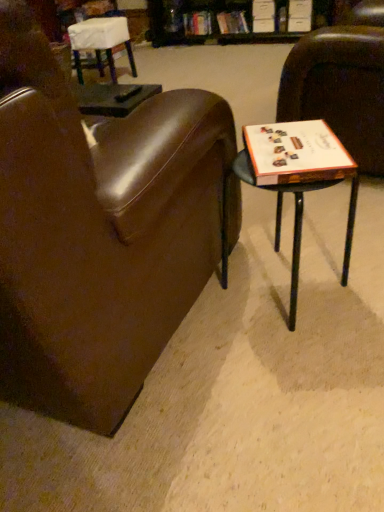
Locate an element on the screen. The width and height of the screenshot is (384, 512). vacant space behind wooden table at right is located at coordinates (288, 224).